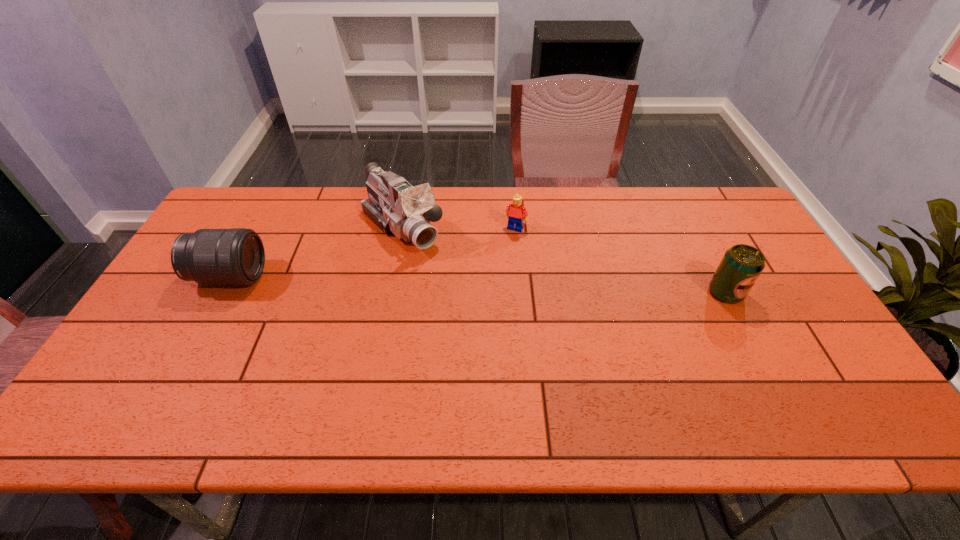
Where is `telephoto lens`? This screenshot has height=540, width=960. telephoto lens is located at coordinates (236, 256).

I want to click on the rightmost object, so 741,265.

This screenshot has height=540, width=960. In order to click on Lego in this screenshot , I will do `click(515, 212)`.

Locate an element on the screen. Image resolution: width=960 pixels, height=540 pixels. camcorder is located at coordinates (395, 206).

I want to click on the third object from right to left, so click(x=395, y=206).

Locate an element on the screen. The image size is (960, 540). blank area located on the surface of the telephoto lens is located at coordinates (344, 277).

This screenshot has height=540, width=960. I want to click on blank area located on the left of the rightmost object, so click(x=637, y=293).

I want to click on vacant region located 0.140m on the front-facing side of the second object from right to left, so click(496, 261).

Where is `vacant space located on the front-facing side of the second object from right to left`? The image size is (960, 540). vacant space located on the front-facing side of the second object from right to left is located at coordinates (482, 288).

Where is `vacant space located 0.050m on the front-facing side of the second object from right to left`? vacant space located 0.050m on the front-facing side of the second object from right to left is located at coordinates (506, 242).